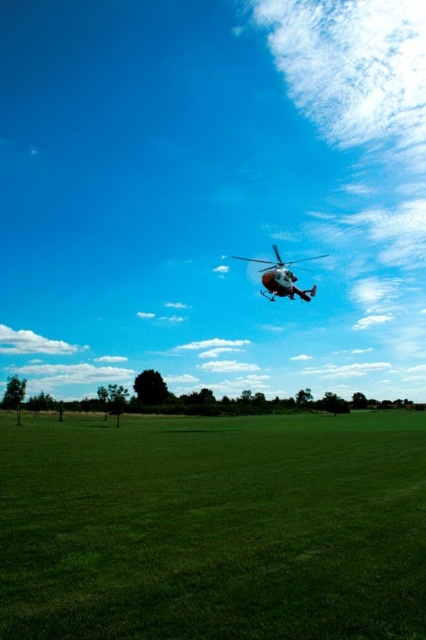
Looking at this image, you are planning to land a drone that requires a landing area wider than the white matte helicopter at upper center. Based on the scene, can the green grass at center provide enough space for the drone to land?

The green grass at center has a larger width than the white matte helicopter at upper center, so yes, the green grass at center can provide enough space for the drone to land.

You are a drone operator trying to land a drone that has a 10 feet wingspan. You are currently above the green grass at center and want to land on the white matte helicopter at upper center. Is there enough space between them to safely land?

The distance between the green grass at center and the white matte helicopter at upper center is 57.64 feet. Since the drone has a 10 feet wingspan, there is sufficient space to safely land between them.

You are a drone operator trying to land your drone on the green grass at center. However, you notice the white matte helicopter at upper center is nearby. Based on the size comparison between the two objects, which one would require more space for safe landing?

The white matte helicopter at upper center requires more space for safe landing since it is larger than the green grass at center.